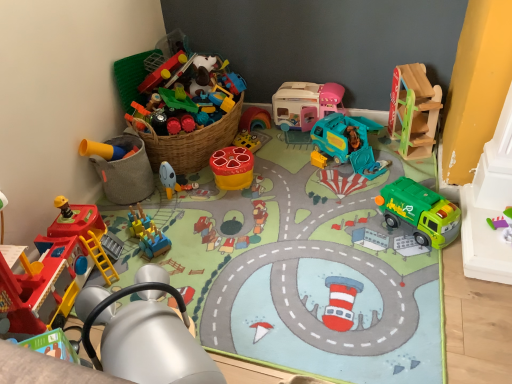
At what (x,y) coordinates should I click in order to perform the action: click on empty space that is in between teal plastic garbage truck at center, marked as the 3th toy in a right-to-left arrangement, and matte plastic stool at center, the fifth toy from the left. Please return your answer as a coordinate pair (x, y). Looking at the image, I should click on (286, 168).